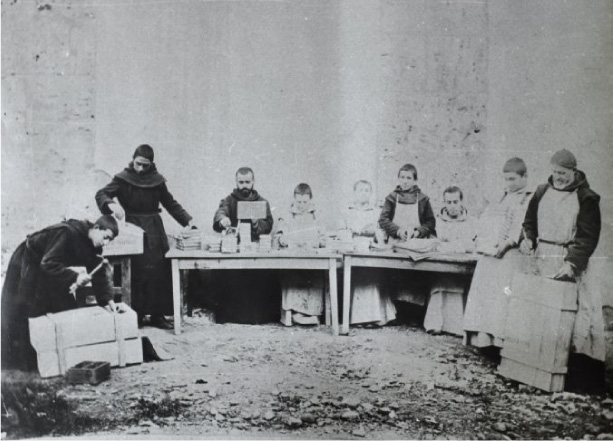
Locate an element on the screen. This screenshot has width=613, height=441. objects on tables is located at coordinates (181, 240), (211, 240), (227, 241), (246, 244), (265, 247), (309, 242), (341, 241), (365, 248), (424, 248), (466, 248).